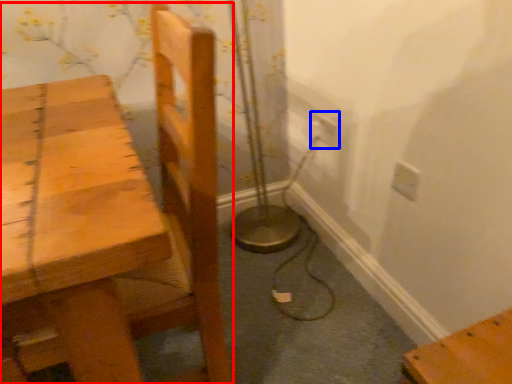
Question: Which object appears closest to the camera in this image, chair (highlighted by a red box) or electric outlet (highlighted by a blue box)?

Choices:
 (A) chair
 (B) electric outlet

Answer: (A)